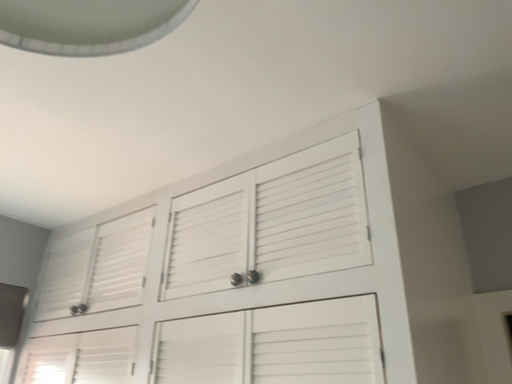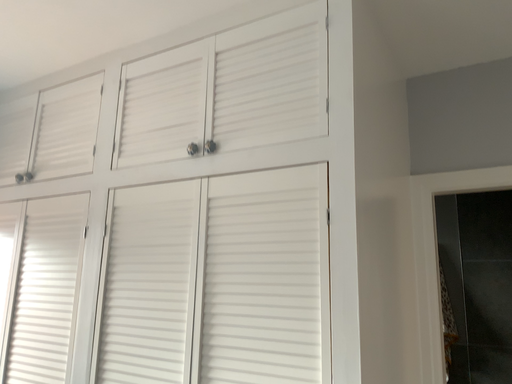
Question: Which way did the camera rotate in the video?

Choices:
 (A) rotated upward
 (B) rotated downward

Answer: (B)